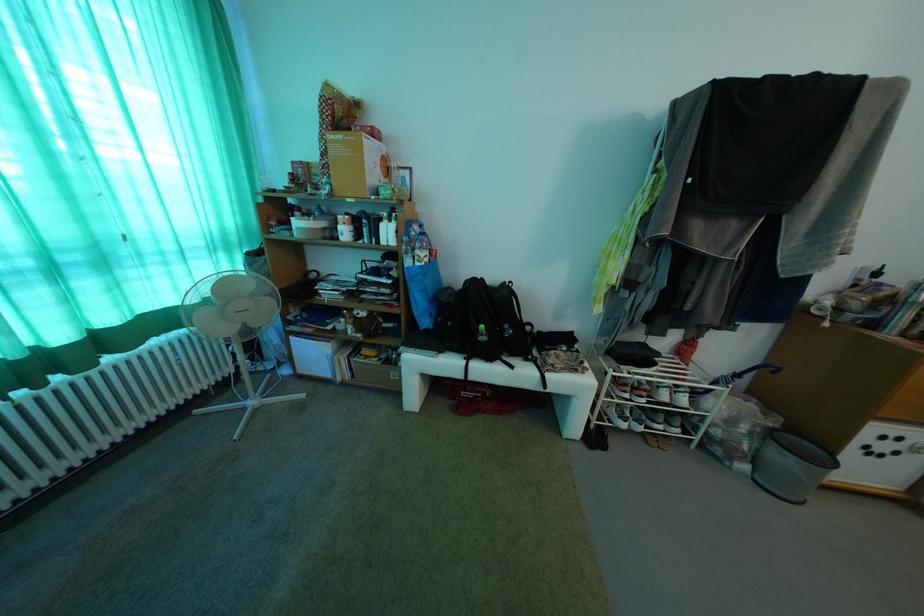
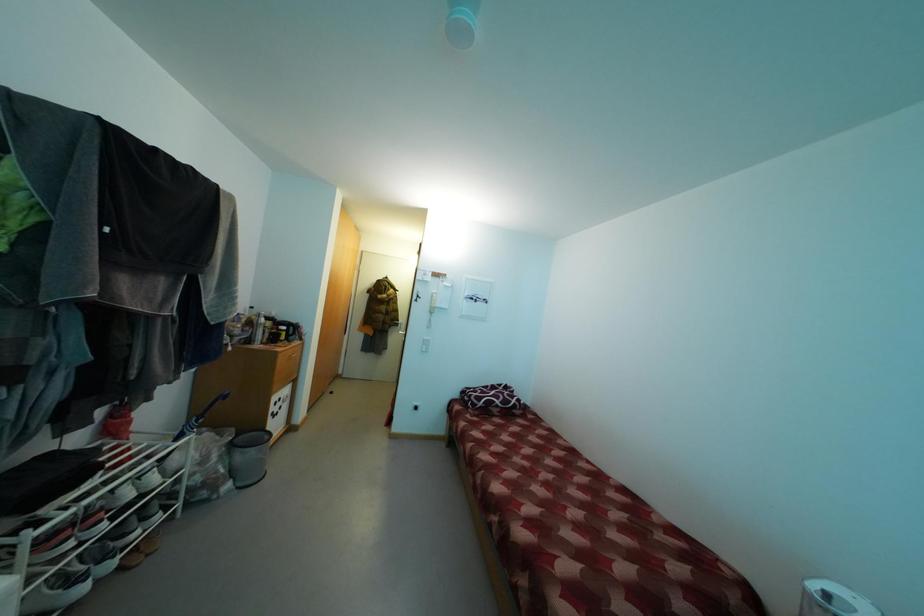
Question: The camera is either moving clockwise (left) or counter-clockwise (right) around the object. The first image is from the beginning of the video and the second image is from the end. Is the camera moving left or right when shooting the video?

Choices:
 (A) Left
 (B) Right

Answer: (A)